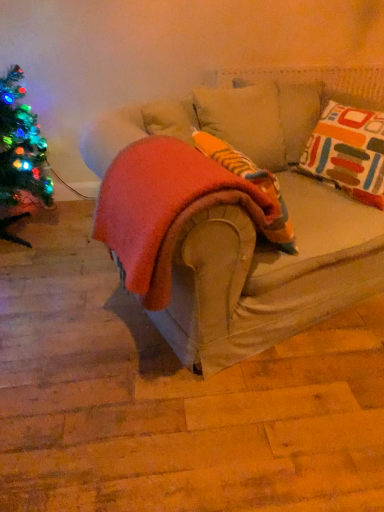
Describe the element at coordinates (164, 208) in the screenshot. The width and height of the screenshot is (384, 512). I see `orange fuzzy blanket at center` at that location.

The height and width of the screenshot is (512, 384). Identify the location of orange fuzzy blanket at center. (164, 208).

Where is `orange fuzzy blanket at center`? This screenshot has height=512, width=384. orange fuzzy blanket at center is located at coordinates (164, 208).